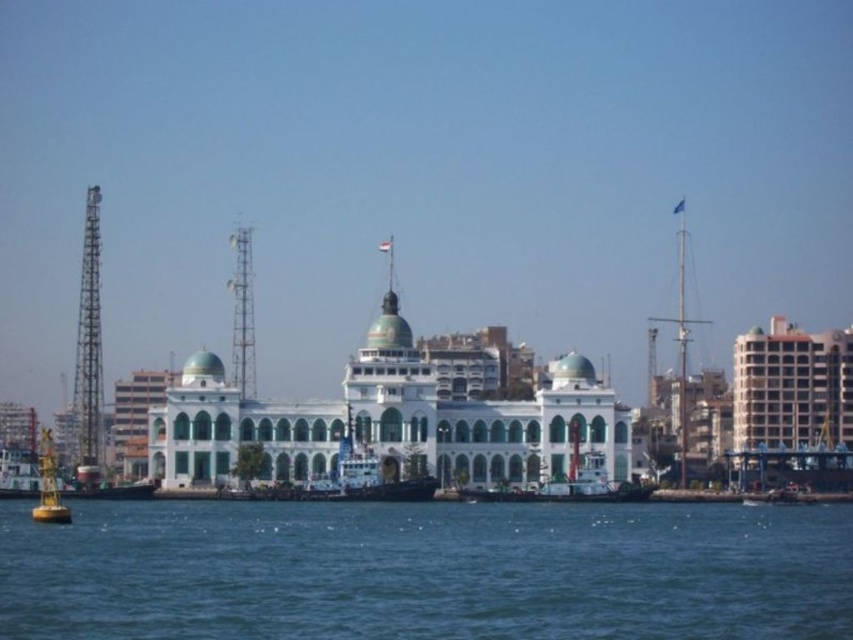
Identify the location of blue water at lower center. (426, 572).

Does blue water at lower center have a larger size compared to white glossy boat at center?

Correct, blue water at lower center is larger in size than white glossy boat at center.

Is point (456, 529) positioned in front of point (360, 470)?

Yes.

Locate an element on the screen. This screenshot has width=853, height=640. blue water at lower center is located at coordinates (426, 572).

You are a GUI agent. You are given a task and a screenshot of the screen. Output one action in this format:
    pyautogui.click(x=<x>, y=<y>)
    Task: Click on the white glossy boat at center
    The height and width of the screenshot is (640, 853).
    Given the screenshot: What is the action you would take?
    pyautogui.click(x=328, y=461)

Is point (347, 589) positioned behind point (642, 492)?

No.

Does blue water at lower center have a lesser width compared to white matte tugboat at center?

In fact, blue water at lower center might be wider than white matte tugboat at center.

Locate an element on the screen. blue water at lower center is located at coordinates (426, 572).

You are a GUI agent. You are given a task and a screenshot of the screen. Output one action in this format:
    pyautogui.click(x=<x>, y=<y>)
    Task: Click on the blue water at lower center
    The image size is (853, 640).
    Given the screenshot: What is the action you would take?
    pyautogui.click(x=426, y=572)